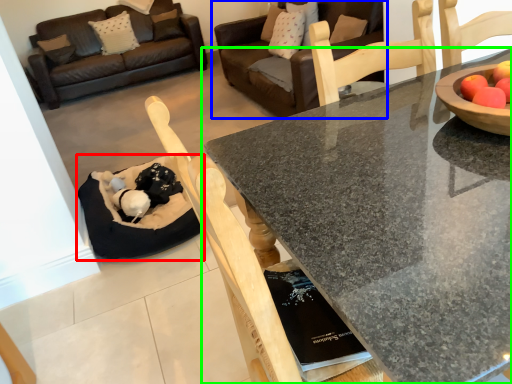
Question: Which is farther away from cat bed (highlighted by a red box)? studio couch (highlighted by a blue box) or coffee table (highlighted by a green box)?

Choices:
 (A) studio couch
 (B) coffee table

Answer: (A)